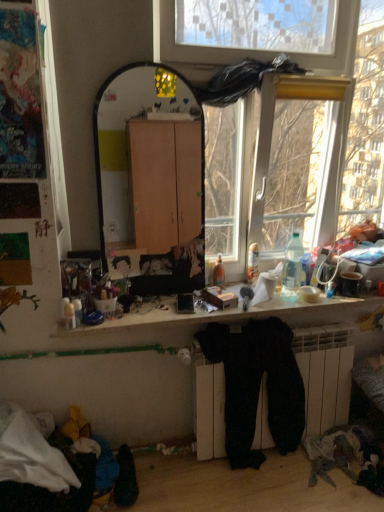
The width and height of the screenshot is (384, 512). Find the location of `free location in front of black velvet pants at lower center`. free location in front of black velvet pants at lower center is located at coordinates (244, 484).